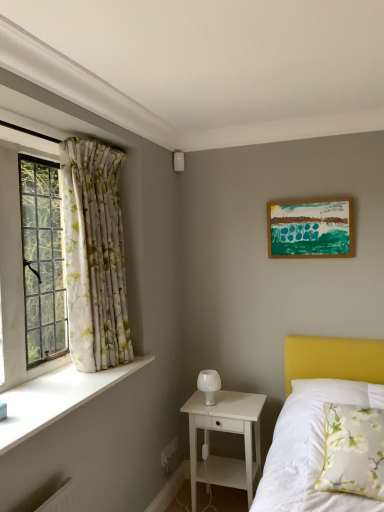
Locate an element on the screen. The image size is (384, 512). vacant region in front of white frosted glass table lamp at center is located at coordinates (222, 410).